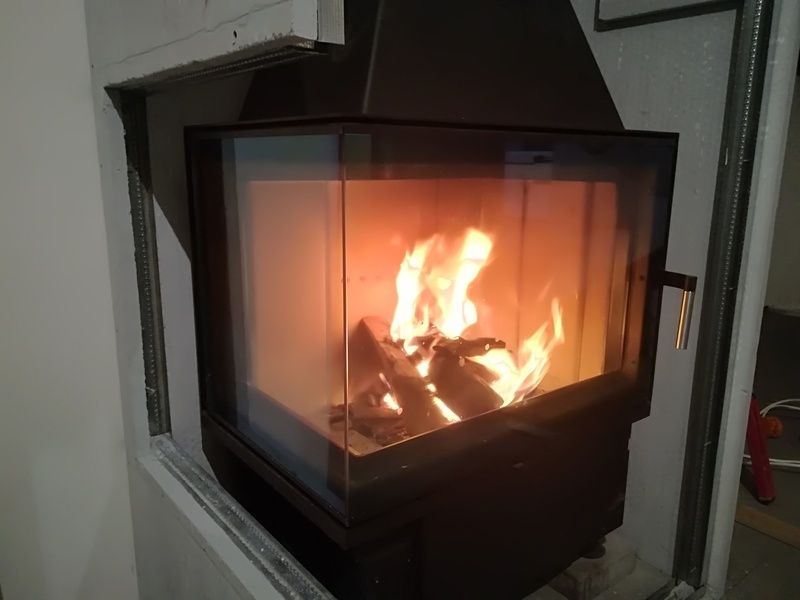
Where is `handle`? handle is located at coordinates (682, 318).